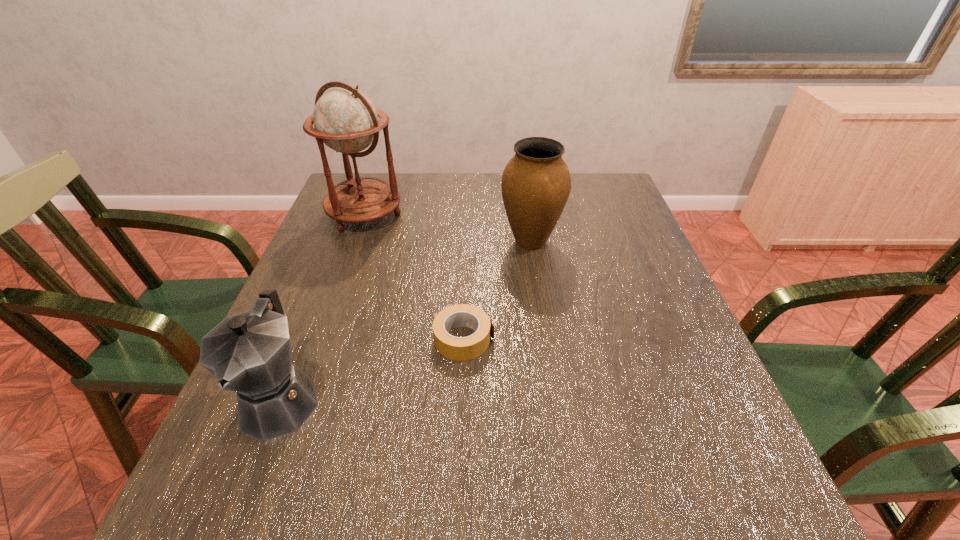
You are a GUI agent. You are given a task and a screenshot of the screen. Output one action in this format:
    pyautogui.click(x=<x>, y=<y>)
    Task: Click on the object that is at the far edge
    
    Given the screenshot: What is the action you would take?
    pyautogui.click(x=345, y=120)

I want to click on globe that is at the left edge, so click(x=345, y=120).

Where is `coffeepot present at the left edge`? The height and width of the screenshot is (540, 960). coffeepot present at the left edge is located at coordinates (249, 353).

Locate an element on the screen. The width and height of the screenshot is (960, 540). object that is at the far left corner is located at coordinates (345, 120).

What are the coordinates of `vacant space at the far edge of the desktop` in the screenshot? It's located at click(466, 184).

This screenshot has height=540, width=960. Find the location of `vacant area at the near edge of the desktop`. vacant area at the near edge of the desktop is located at coordinates (424, 530).

Locate an element on the screen. The image size is (960, 540). vacant area at the left edge is located at coordinates (372, 227).

I want to click on vacant space at the right edge of the desktop, so pyautogui.click(x=636, y=249).

In order to click on vacant space at the far right corner in this screenshot , I will do `click(591, 210)`.

Find the location of a particular element. The width and height of the screenshot is (960, 540). vacant point at the near right corner is located at coordinates (736, 537).